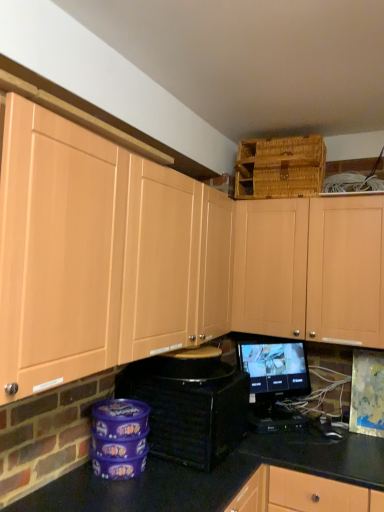
The height and width of the screenshot is (512, 384). I want to click on matte wood cabinet at upper center, the second cabinetry from the left, so click(x=311, y=269).

In order to face black plastic toaster at lower center, should I rotate leftwards or rightwards?

To align with it, rotate left about 0.532°.

Measure the distance between matte wood cabinets at upper left, the first cabinetry positioned from the left, and camera.

The distance of matte wood cabinets at upper left, the first cabinetry positioned from the left, from camera is 37.72 inches.

Identify the location of matte wood cabinet at upper center, the second cabinetry from the left. (311, 269).

Can you confirm if black glossy monitor at center is wider than woven brown basket at upper right?

In fact, black glossy monitor at center might be narrower than woven brown basket at upper right.

Is woven brown basket at upper right completely or partially inside black glossy monitor at center?

No, woven brown basket at upper right is not inside black glossy monitor at center.

Does black glossy monitor at center turn towards woven brown basket at upper right?

No, black glossy monitor at center does not turn towards woven brown basket at upper right.

From the picture: Is matte wood cabinet at upper center, the 1th cabinetry from the right, spatially inside black plastic toaster at lower center, or outside of it?

matte wood cabinet at upper center, the 1th cabinetry from the right, cannot be found inside black plastic toaster at lower center.

From the image's perspective, between matte wood cabinet at upper center, the second cabinetry from the left, and black plastic toaster at lower center, who is located below?

black plastic toaster at lower center, from the image's perspective.

Is matte wood cabinet at upper center, the 1th cabinetry from the right, far from black plastic toaster at lower center?

No.

In the image, there is a matte wood cabinet at upper center, the second cabinetry from the left. Find the location of `appliance below it (from a real-world perspective)`. appliance below it (from a real-world perspective) is located at coordinates (189, 406).

Where is `cabinetry behind the black plastic toaster at lower center`? This screenshot has height=512, width=384. cabinetry behind the black plastic toaster at lower center is located at coordinates (311, 269).

Which object is more forward, black plastic toaster at lower center or matte wood cabinet at upper center, the second cabinetry from the left?

black plastic toaster at lower center.

Does black plastic toaster at lower center contain matte wood cabinet at upper center, the 1th cabinetry from the right?

No, matte wood cabinet at upper center, the 1th cabinetry from the right, is located outside of black plastic toaster at lower center.

Considering the relative sizes of black plastic toaster at lower center and matte wood cabinet at upper center, the second cabinetry from the left, in the image provided, is black plastic toaster at lower center smaller than matte wood cabinet at upper center, the second cabinetry from the left,?

Yes.

Is woven brown basket at upper right not within matte wood cabinets at upper left, arranged as the second cabinetry when viewed from the right?

woven brown basket at upper right lies outside matte wood cabinets at upper left, arranged as the second cabinetry when viewed from the right,'s area.

Is woven brown basket at upper right positioned far away from matte wood cabinets at upper left, the first cabinetry positioned from the left?

Actually, woven brown basket at upper right and matte wood cabinets at upper left, the first cabinetry positioned from the left, are a little close together.

Considering the points (249, 182) and (44, 132), which point is in front, point (249, 182) or point (44, 132)?

The point (44, 132) is more forward.

Which is behind, woven brown basket at upper right or matte wood cabinets at upper left, the first cabinetry positioned from the left?

Positioned behind is woven brown basket at upper right.

Consider the image. Which point is more distant from viewer, (256, 373) or (202, 420)?

The point (256, 373) is farther from the camera.

Which is behind, black glossy monitor at center or black plastic toaster at lower center?

black glossy monitor at center is further away from the camera.

Does black glossy monitor at center turn towards black plastic toaster at lower center?

No, black glossy monitor at center is not facing towards black plastic toaster at lower center.

Can you confirm if black glossy monitor at center is positioned to the right of black plastic toaster at lower center?

Yes.

Does point (286, 313) lie in front of point (268, 194)?

Yes, point (286, 313) is closer to viewer.

Considering the sizes of matte wood cabinets at upper left, arranged as the second cabinetry when viewed from the right, and woven brown basket at upper right in the image, is matte wood cabinets at upper left, arranged as the second cabinetry when viewed from the right, taller or shorter than woven brown basket at upper right?

matte wood cabinets at upper left, arranged as the second cabinetry when viewed from the right, is taller than woven brown basket at upper right.

In the scene shown: Which object is closer to the camera, matte wood cabinets at upper left, the first cabinetry positioned from the left, or woven brown basket at upper right?

Positioned in front is matte wood cabinets at upper left, the first cabinetry positioned from the left.

How different are the orientations of matte wood cabinets at upper left, the first cabinetry positioned from the left, and woven brown basket at upper right in degrees?

88.7 degrees.

Can you tell me how much black plastic toaster at lower center and woven brown basket at upper right differ in facing direction?

They differ by 88.4 degrees in their facing directions.

Can you confirm if black plastic toaster at lower center is taller than woven brown basket at upper right?

No.

From a real-world perspective, which object rests below the other?

black plastic toaster at lower center is physically lower.

Consider the image. Who is more distant, black plastic toaster at lower center or woven brown basket at upper right?

woven brown basket at upper right is further from the camera.

At what (x,y) coordinates should I click in order to perform the action: click on basket positioned vertically above the black glossy monitor at center (from a real-world perspective). Please return your answer as a coordinate pair (x, y). Looking at the image, I should click on (280, 167).

Image resolution: width=384 pixels, height=512 pixels. Find the location of `cabinetry on the right of black plastic toaster at lower center`. cabinetry on the right of black plastic toaster at lower center is located at coordinates (311, 269).

From the picture: Which object lies further to the anchor point black glossy monitor at center, woven brown basket at upper right or matte wood cabinets at upper left, the first cabinetry positioned from the left?

woven brown basket at upper right lies further to black glossy monitor at center than the other object.

From the image, which object appears to be nearer to black plastic toaster at lower center, black glossy monitor at center or matte wood cabinet at upper center, the second cabinetry from the left?

The object closer to black plastic toaster at lower center is black glossy monitor at center.

When comparing their distances from matte wood cabinet at upper center, the 1th cabinetry from the right, does black plastic toaster at lower center or black glossy monitor at center seem further?

Based on the image, black plastic toaster at lower center appears to be further to matte wood cabinet at upper center, the 1th cabinetry from the right.

Considering their positions, is matte wood cabinets at upper left, arranged as the second cabinetry when viewed from the right, positioned closer to black plastic toaster at lower center than matte wood cabinet at upper center, the 1th cabinetry from the right?

matte wood cabinets at upper left, arranged as the second cabinetry when viewed from the right, is closer to black plastic toaster at lower center.

Based on their spatial positions, is matte wood cabinet at upper center, the 1th cabinetry from the right, or woven brown basket at upper right further from black glossy monitor at center?

woven brown basket at upper right.

Which object lies further to the anchor point black plastic toaster at lower center, woven brown basket at upper right or matte wood cabinets at upper left, arranged as the second cabinetry when viewed from the right?

woven brown basket at upper right lies further to black plastic toaster at lower center than the other object.

When comparing their distances from woven brown basket at upper right, does black plastic toaster at lower center or black glossy monitor at center seem closer?

Based on the image, black glossy monitor at center appears to be nearer to woven brown basket at upper right.

Which object lies nearer to the anchor point woven brown basket at upper right, matte wood cabinet at upper center, the 1th cabinetry from the right, or black plastic toaster at lower center?

matte wood cabinet at upper center, the 1th cabinetry from the right, is closer to woven brown basket at upper right.

The image size is (384, 512). What are the coordinates of `computer monitor between matte wood cabinet at upper center, the second cabinetry from the left, and black plastic toaster at lower center vertically` in the screenshot? It's located at (274, 369).

This screenshot has height=512, width=384. What are the coordinates of `cabinetry between matte wood cabinets at upper left, the first cabinetry positioned from the left, and woven brown basket at upper right from front to back` in the screenshot? It's located at (311, 269).

You are a GUI agent. You are given a task and a screenshot of the screen. Output one action in this format:
    pyautogui.click(x=<x>, y=<y>)
    Task: Click on the basket between matte wood cabinets at upper left, the first cabinetry positioned from the left, and black glossy monitor at center from front to back
    This screenshot has height=512, width=384.
    Given the screenshot: What is the action you would take?
    point(280,167)

Where is `appliance between matte wood cabinets at upper left, arranged as the second cabinetry when viewed from the right, and matte wood cabinet at upper center, the second cabinetry from the left, along the z-axis`? This screenshot has width=384, height=512. appliance between matte wood cabinets at upper left, arranged as the second cabinetry when viewed from the right, and matte wood cabinet at upper center, the second cabinetry from the left, along the z-axis is located at coordinates (189, 406).